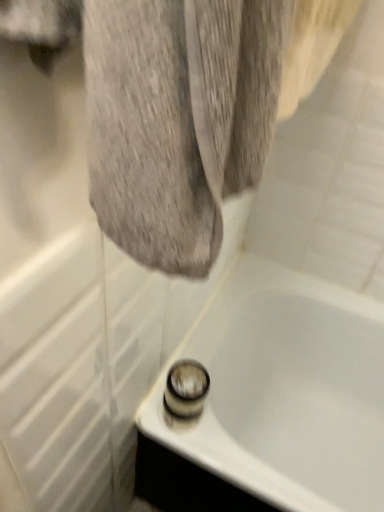
Question: In terms of width, does white glossy bathtub at lower center look wider or thinner when compared to shiny chrome shower at bottom center?

Choices:
 (A) wide
 (B) thin

Answer: (A)

Question: Is white glossy bathtub at lower center spatially inside shiny chrome shower at bottom center, or outside of it?

Choices:
 (A) outside
 (B) inside

Answer: (A)

Question: Based on their sizes in the image, would you say white glossy bathtub at lower center is bigger or smaller than shiny chrome shower at bottom center?

Choices:
 (A) small
 (B) big

Answer: (B)

Question: Considering the positions of shiny chrome shower at bottom center and white glossy bathtub at lower center in the image, is shiny chrome shower at bottom center bigger or smaller than white glossy bathtub at lower center?

Choices:
 (A) big
 (B) small

Answer: (B)

Question: Is point (195, 395) positioned closer to the camera than point (231, 339)?

Choices:
 (A) closer
 (B) farther

Answer: (A)

Question: From a real-world perspective, is shiny chrome shower at bottom center positioned above or below white glossy bathtub at lower center?

Choices:
 (A) above
 (B) below

Answer: (A)

Question: Looking at their shapes, would you say shiny chrome shower at bottom center is wider or thinner than white glossy bathtub at lower center?

Choices:
 (A) thin
 (B) wide

Answer: (A)